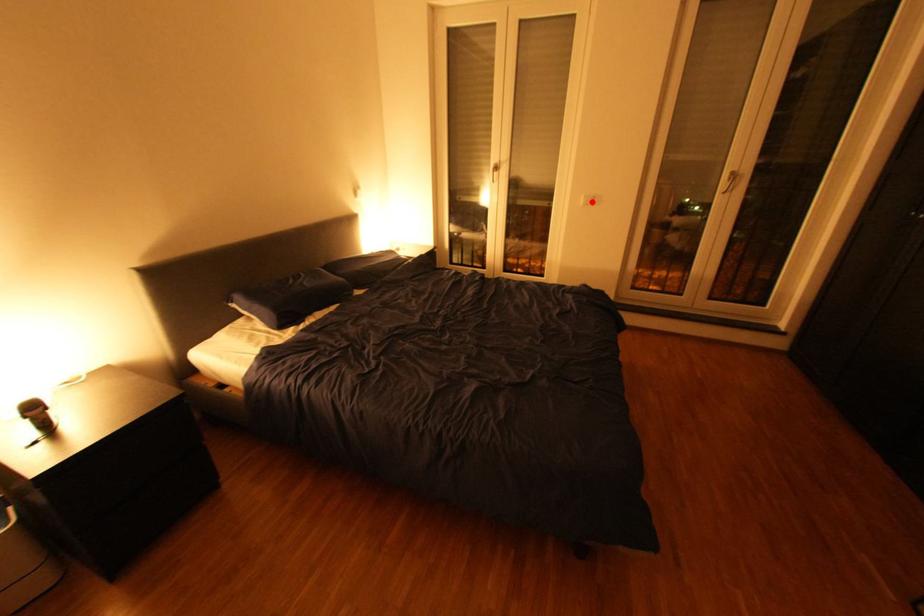
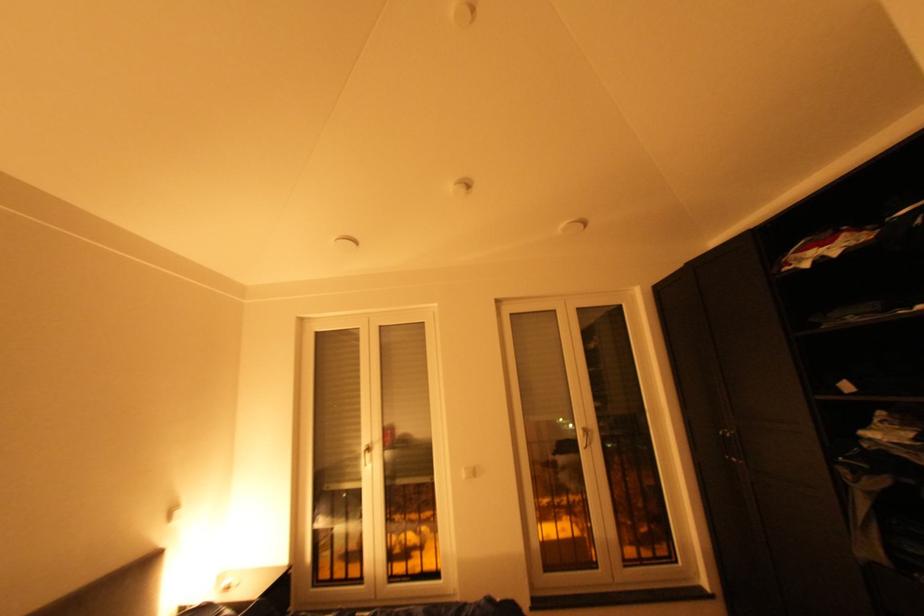
The point at the highlighted location is marked in the first image. Where is the corresponding point in the second image?

(473, 476)